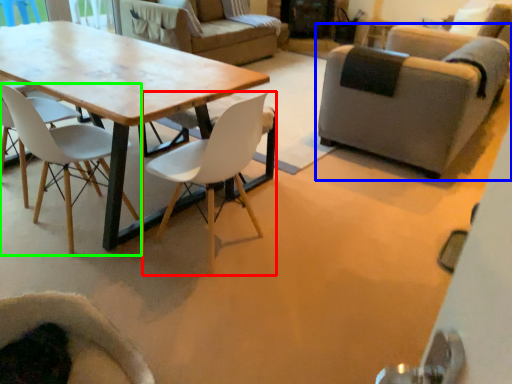
Question: Which object is positioned closest to chair (highlighted by a red box)? Select from chair (highlighted by a blue box) and chair (highlighted by a green box).

Choices:
 (A) chair
 (B) chair

Answer: (B)